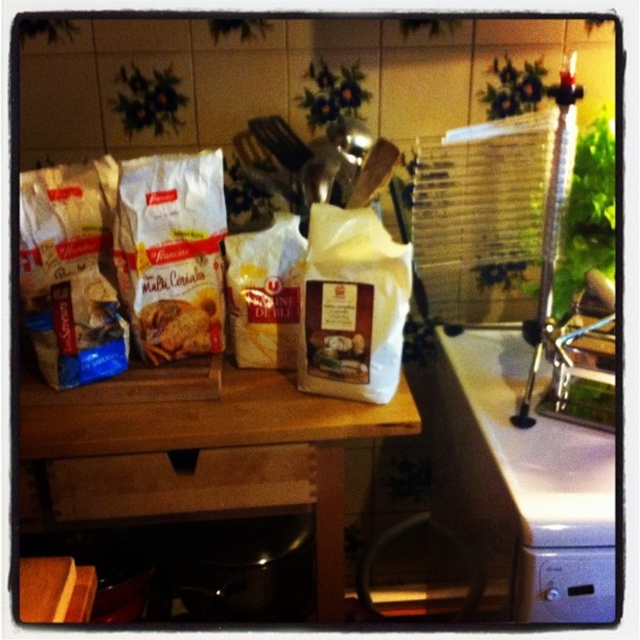
You are a baker trying to locate the white matte cookie mix at center in the kitchen. According to the coordinates provided, where exactly should you look?

The white matte cookie mix at center is located at point [172,253].

You are a baker preparing to stack ingredients on a shelf. You have the white matte cookie mix at center and the white matte sack at center. Which one should you place first to ensure stability?

The white matte cookie mix at center is much taller than the white matte sack at center, so it should be placed first at the bottom for stability.

You are standing in the kitchen and want to place a small bowl of lemons on the white glossy countertop at lower right. Based on the coordinates provided, where exactly should you place it?

The white glossy countertop at lower right is located at point [529,480], so place the bowl there.